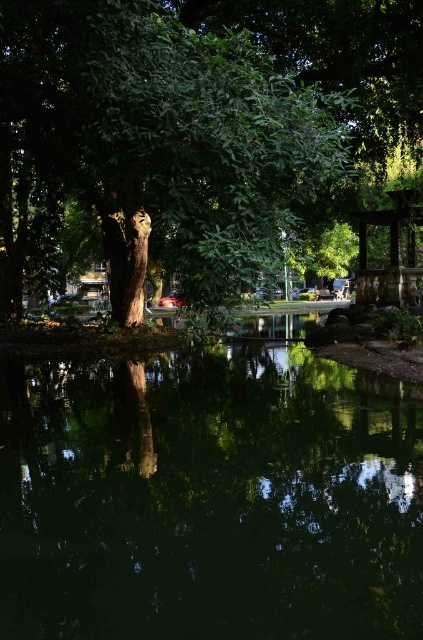
Question: Which point appears closest to the camera in this image?

Choices:
 (A) (58, 632)
 (B) (76, 36)

Answer: (A)

Question: Does green reflective water at center appear on the right side of wooden gazebo at right?

Choices:
 (A) yes
 (B) no

Answer: (B)

Question: Which is farther from the wooden gazebo at right?

Choices:
 (A) green reflective water at center
 (B) green leafy tree at center

Answer: (A)

Question: Which of these objects is positioned farthest from the green reflective water at center?

Choices:
 (A) wooden gazebo at right
 (B) green leafy tree at center

Answer: (A)

Question: Considering the relative positions of green reflective water at center and wooden gazebo at right in the image provided, where is green reflective water at center located with respect to wooden gazebo at right?

Choices:
 (A) below
 (B) above

Answer: (A)

Question: Is green reflective water at center below wooden gazebo at right?

Choices:
 (A) yes
 (B) no

Answer: (A)